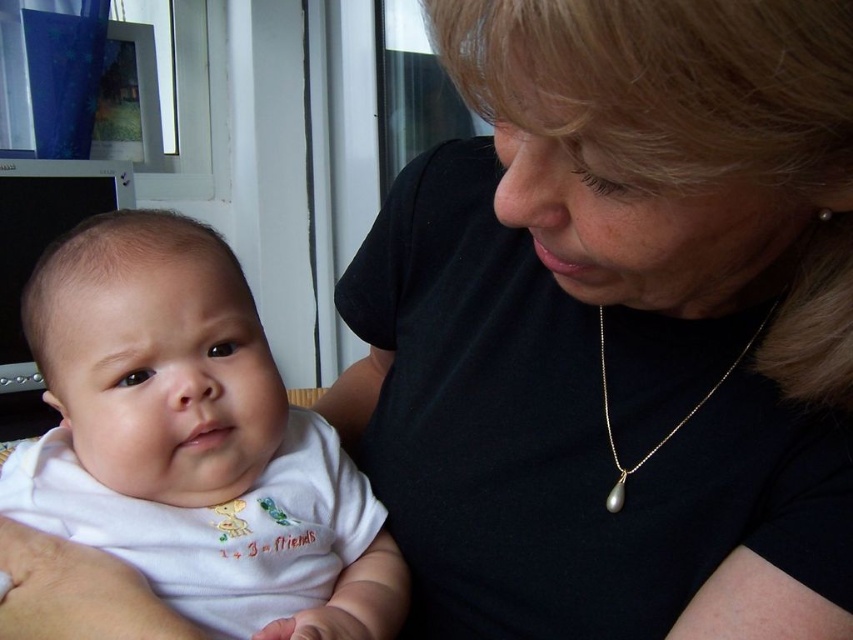
Question: Which point is farther to the camera?

Choices:
 (A) black matte shirt at center
 (B) white soft fabric baby at center

Answer: (B)

Question: From the image, what is the correct spatial relationship of black matte shirt at center in relation to white soft fabric baby at center?

Choices:
 (A) above
 (B) below

Answer: (A)

Question: Among these objects, which one is nearest to the camera?

Choices:
 (A) black matte shirt at center
 (B) gold pearl necklace at lower center
 (C) white soft fabric baby at center

Answer: (A)

Question: Can you confirm if black matte shirt at center is positioned above gold pearl necklace at lower center?

Choices:
 (A) no
 (B) yes

Answer: (A)

Question: Which point appears closest to the camera in this image?

Choices:
 (A) (722, 376)
 (B) (245, 352)

Answer: (A)

Question: Does white soft fabric baby at center have a greater width compared to gold pearl necklace at lower center?

Choices:
 (A) no
 (B) yes

Answer: (B)